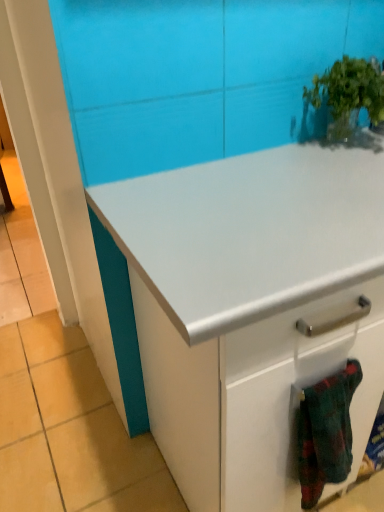
Question: Considering the relative sizes of flannel fabric blanket at lower right and white glossy cabinet at center in the image provided, is flannel fabric blanket at lower right thinner than white glossy cabinet at center?

Choices:
 (A) yes
 (B) no

Answer: (A)

Question: Could you tell me if flannel fabric blanket at lower right is facing white glossy cabinet at center?

Choices:
 (A) no
 (B) yes

Answer: (A)

Question: Can you confirm if flannel fabric blanket at lower right is positioned to the left of white glossy cabinet at center?

Choices:
 (A) yes
 (B) no

Answer: (A)

Question: Is the surface of flannel fabric blanket at lower right in direct contact with white glossy cabinet at center?

Choices:
 (A) yes
 (B) no

Answer: (B)

Question: Is white glossy cabinet at center located within flannel fabric blanket at lower right?

Choices:
 (A) yes
 (B) no

Answer: (B)

Question: From the image's perspective, would you say flannel fabric blanket at lower right is shown under white glossy cabinet at center?

Choices:
 (A) no
 (B) yes

Answer: (B)

Question: Would you consider green leafy plant at upper right to be distant from white glossy cabinet at center?

Choices:
 (A) yes
 (B) no

Answer: (B)

Question: Is green leafy plant at upper right to the right of white glossy cabinet at center from the viewer's perspective?

Choices:
 (A) no
 (B) yes

Answer: (A)

Question: Is the surface of green leafy plant at upper right in direct contact with white glossy cabinet at center?

Choices:
 (A) no
 (B) yes

Answer: (A)

Question: Is green leafy plant at upper right to the left of white glossy cabinet at center from the viewer's perspective?

Choices:
 (A) yes
 (B) no

Answer: (A)

Question: Is green leafy plant at upper right not inside white glossy cabinet at center?

Choices:
 (A) no
 (B) yes

Answer: (B)

Question: Could you tell me if green leafy plant at upper right is turned towards white glossy cabinet at center?

Choices:
 (A) no
 (B) yes

Answer: (A)

Question: Can you confirm if flannel fabric blanket at lower right is smaller than green leafy plant at upper right?

Choices:
 (A) yes
 (B) no

Answer: (A)